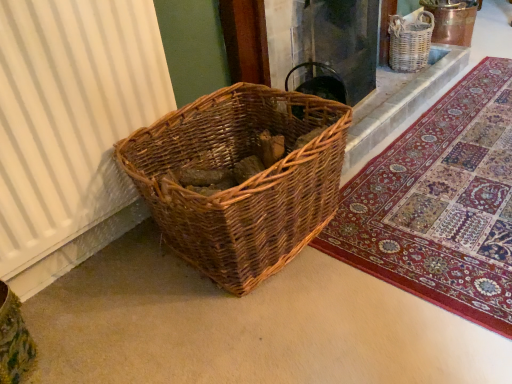
Locate an element on the screen. Image resolution: width=512 pixels, height=384 pixels. rich tapestry rug at lower right is located at coordinates (438, 205).

In the scene shown: Measure the distance between woven brown basket at upper right and camera.

woven brown basket at upper right and camera are 2.17 meters apart.

Where is `woven brown basket at upper right`? woven brown basket at upper right is located at coordinates (x=410, y=42).

You are a GUI agent. You are given a task and a screenshot of the screen. Output one action in this format:
    pyautogui.click(x=<x>, y=<y>)
    Task: Click on the woven wood basket at lower left
    This screenshot has height=384, width=512.
    Given the screenshot: What is the action you would take?
    pyautogui.click(x=243, y=183)

Find the location of a particular element. Image resolution: width=512 pixels, height=384 pixels. curtain above the rich tapestry rug at lower right (from a real-world perspective) is located at coordinates (71, 116).

Would you say white ribbed curtain at left contains rich tapestry rug at lower right?

No, rich tapestry rug at lower right is not a part of white ribbed curtain at left.

Between white ribbed curtain at left and rich tapestry rug at lower right, which one has smaller size?

white ribbed curtain at left is smaller.

Which object is closer to the camera, woven wood basket at lower left or rich tapestry rug at lower right?

woven wood basket at lower left is more forward.

Can you confirm if woven wood basket at lower left is thinner than rich tapestry rug at lower right?

Correct, the width of woven wood basket at lower left is less than that of rich tapestry rug at lower right.

Is woven wood basket at lower left at the right side of rich tapestry rug at lower right?

No, woven wood basket at lower left is not to the right of rich tapestry rug at lower right.

From the image's perspective, is woven wood basket at lower left below rich tapestry rug at lower right?

Yes, from the image's perspective, woven wood basket at lower left is below rich tapestry rug at lower right.

Is woven brown basket at upper right turned away from woven wood basket at lower left?

woven brown basket at upper right is not turned away from woven wood basket at lower left.

Does woven brown basket at upper right touch woven wood basket at lower left?

No, woven brown basket at upper right is not making contact with woven wood basket at lower left.

Which object is positioned more to the right, woven brown basket at upper right or woven wood basket at lower left?

Positioned to the right is woven brown basket at upper right.

Does woven wood basket at upper center lie behind rich tapestry rug at lower right?

Yes, it is behind rich tapestry rug at lower right.

Can you confirm if woven wood basket at upper center is thinner than rich tapestry rug at lower right?

Yes, woven wood basket at upper center is thinner than rich tapestry rug at lower right.

At what (x,y) coordinates should I click in order to perform the action: click on mat in front of the woven wood basket at upper center. Please return your answer as a coordinate pair (x, y). The width and height of the screenshot is (512, 384). Looking at the image, I should click on pyautogui.click(x=438, y=205).

Is woven wood basket at upper center at the right side of rich tapestry rug at lower right?

No, woven wood basket at upper center is not to the right of rich tapestry rug at lower right.

Is woven wood basket at lower left wider than white ribbed curtain at left?

Correct, the width of woven wood basket at lower left exceeds that of white ribbed curtain at left.

Considering the positions of objects woven wood basket at lower left and white ribbed curtain at left in the image provided, who is more to the left, woven wood basket at lower left or white ribbed curtain at left?

white ribbed curtain at left is more to the left.

Where is `picnic basket on the right of white ribbed curtain at left`? picnic basket on the right of white ribbed curtain at left is located at coordinates (243, 183).

Which is nearer, (42,125) or (399,26)?

Point (42,125).

From a real-world perspective, is white ribbed curtain at left beneath woven brown basket at upper right?

Actually, white ribbed curtain at left is physically above woven brown basket at upper right in the real world.

Considering the relative sizes of white ribbed curtain at left and woven brown basket at upper right in the image provided, is white ribbed curtain at left bigger than woven brown basket at upper right?

Yes.

Between rich tapestry rug at lower right and white ribbed curtain at left, which one is positioned in front?

white ribbed curtain at left is more forward.

Which is closer, (394, 244) or (160, 100)?

Point (394, 244)

From a real-world perspective, is rich tapestry rug at lower right located beneath white ribbed curtain at left?

Yes, from a real-world perspective, rich tapestry rug at lower right is below white ribbed curtain at left.

Considering the relative sizes of rich tapestry rug at lower right and white ribbed curtain at left in the image provided, is rich tapestry rug at lower right thinner than white ribbed curtain at left?

Incorrect, the width of rich tapestry rug at lower right is not less than that of white ribbed curtain at left.

Image resolution: width=512 pixels, height=384 pixels. I want to click on curtain above the rich tapestry rug at lower right (from a real-world perspective), so click(x=71, y=116).

Find the location of a particular element. Image resolution: width=512 pixels, height=384 pixels. mat on the right of woven wood basket at lower left is located at coordinates click(x=438, y=205).

Estimate the real-world distances between objects in this image. Which object is closer to woven brown basket at upper right, white ribbed curtain at left or woven wood basket at upper center?

woven wood basket at upper center is closer to woven brown basket at upper right.

Based on their spatial positions, is woven brown basket at upper right or rich tapestry rug at lower right further from woven wood basket at upper center?

rich tapestry rug at lower right.

Which object lies nearer to the anchor point woven wood basket at lower left, woven brown basket at upper right or rich tapestry rug at lower right?

rich tapestry rug at lower right lies closer to woven wood basket at lower left than the other object.

From the picture: Looking at the image, which one is located closer to rich tapestry rug at lower right, white ribbed curtain at left or woven wood basket at lower left?

woven wood basket at lower left is positioned closer to the anchor rich tapestry rug at lower right.

Estimate the real-world distances between objects in this image. Which object is further from woven brown basket at upper right, white ribbed curtain at left or woven wood basket at lower left?

white ribbed curtain at left lies further to woven brown basket at upper right than the other object.

From the image, which object appears to be farther from white ribbed curtain at left, woven wood basket at lower left or woven brown basket at upper right?

The object further to white ribbed curtain at left is woven brown basket at upper right.

Estimate the real-world distances between objects in this image. Which object is further from rich tapestry rug at lower right, woven brown basket at upper right or white ribbed curtain at left?

woven brown basket at upper right is positioned further to the anchor rich tapestry rug at lower right.

Looking at the image, which one is located further to woven brown basket at upper right, woven wood basket at lower left or rich tapestry rug at lower right?

woven wood basket at lower left is positioned further to the anchor woven brown basket at upper right.

Locate an element on the screen. screen door between white ribbed curtain at left and woven brown basket at upper right is located at coordinates (338, 49).

At what (x,y) coordinates should I click in order to perform the action: click on picnic basket positioned between white ribbed curtain at left and woven wood basket at upper center from near to far. Please return your answer as a coordinate pair (x, y). The width and height of the screenshot is (512, 384). Looking at the image, I should click on (243, 183).

You are a GUI agent. You are given a task and a screenshot of the screen. Output one action in this format:
    pyautogui.click(x=<x>, y=<y>)
    Task: Click on the mat located between woven wood basket at lower left and woven brown basket at upper right in the depth direction
    
    Given the screenshot: What is the action you would take?
    pyautogui.click(x=438, y=205)

The image size is (512, 384). In order to click on screen door between white ribbed curtain at left and rich tapestry rug at lower right from left to right in this screenshot , I will do `click(338, 49)`.